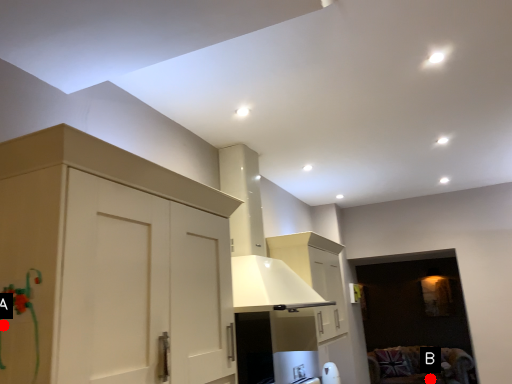
Question: Two points are circled on the image, labeled by A and B beside each circle. Which point is closer to the camera?

Choices:
 (A) A is closer
 (B) B is closer

Answer: (A)